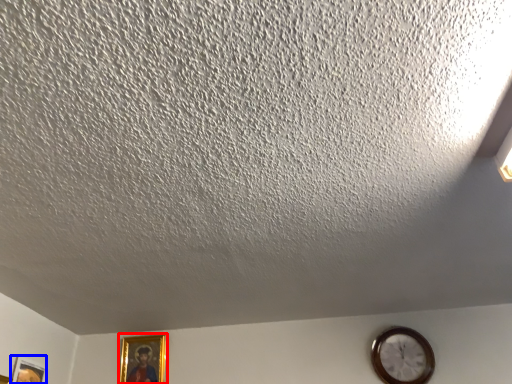
Question: Which of the following is the closest to the observer, picture frame (highlighted by a red box) or picture frame (highlighted by a blue box)?

Choices:
 (A) picture frame
 (B) picture frame

Answer: (B)